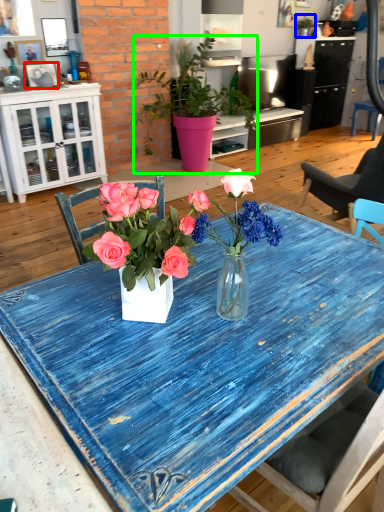
Question: Which object is positioned farthest from picture frame (highlighted by a red box)? Select from houseplant (highlighted by a blue box) and houseplant (highlighted by a green box).

Choices:
 (A) houseplant
 (B) houseplant

Answer: (A)